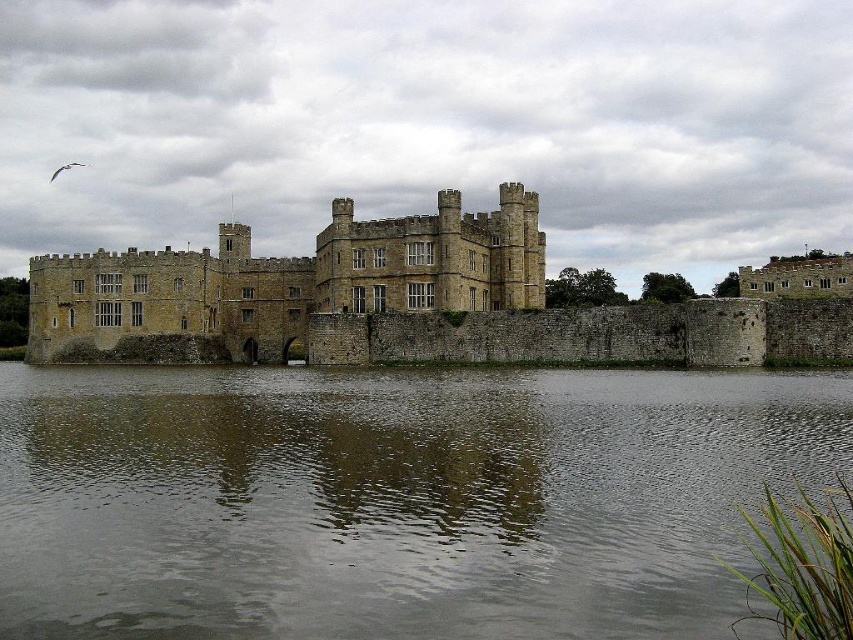
Image resolution: width=853 pixels, height=640 pixels. Describe the element at coordinates (282, 284) in the screenshot. I see `stone castle at center` at that location.

This screenshot has height=640, width=853. What are the coordinates of `stone castle at center` in the screenshot? It's located at (282, 284).

I want to click on stone castle at center, so click(x=282, y=284).

Which of these two, gray reflective water at center or brown stone castle at upper right, stands taller?

brown stone castle at upper right

Is point (347, 540) more distant than point (827, 253)?

That is False.

Who is more distant from viewer, (758, 424) or (766, 273)?

The point (766, 273) is more distant.

The image size is (853, 640). I want to click on gray reflective water at center, so click(393, 499).

Is gray reflective water at center above stone castle at center?

No.

Does gray reflective water at center appear on the left side of stone castle at center?

No, gray reflective water at center is not to the left of stone castle at center.

Who is more distant from viewer, (341,627) or (90,292)?

The point (90,292) is behind.

Where is `gray reflective water at center`? The height and width of the screenshot is (640, 853). gray reflective water at center is located at coordinates (393, 499).